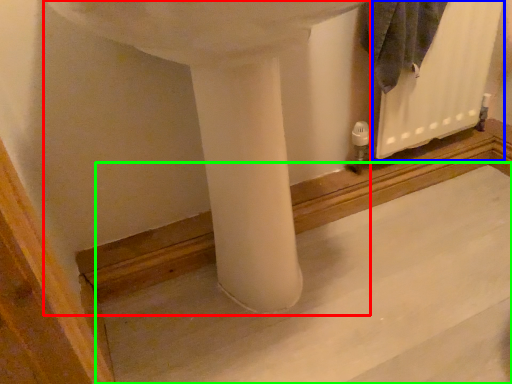
Question: Which object is the closest to the sink (highlighted by a red box)? Choose among these: radiator (highlighted by a blue box) or concrete (highlighted by a green box).

Choices:
 (A) radiator
 (B) concrete

Answer: (B)